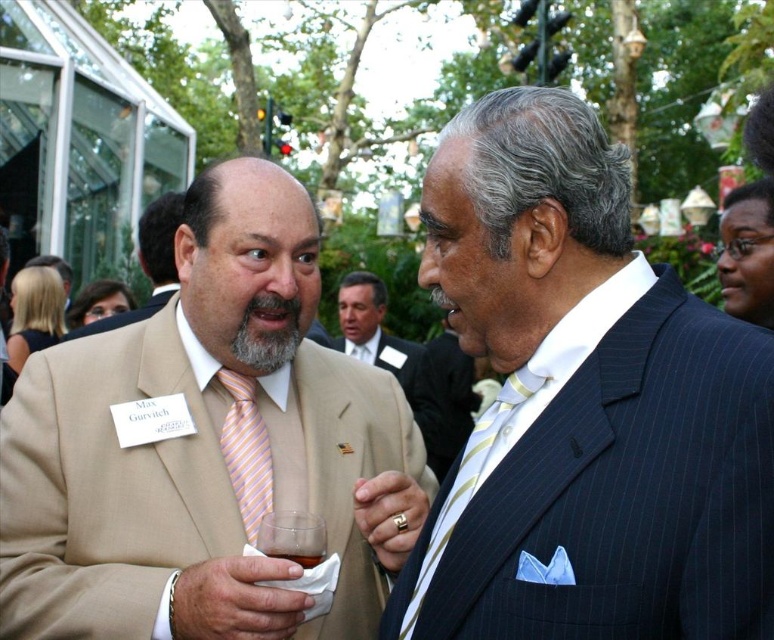
Between gold striped tie at center and light brown suit at center, which one appears on the left side from the viewer's perspective?

Positioned to the left is light brown suit at center.

Is the position of gold striped tie at center less distant than that of light brown suit at center?

Yes, gold striped tie at center is in front of light brown suit at center.

I want to click on gold striped tie at center, so click(471, 477).

Does dark blue pinstripe suit at center have a lesser height compared to beige fabric suit at left?

No.

Between point (451, 202) and point (98, 324), which one is positioned in front?

Point (451, 202)

Find the location of a particular element. The height and width of the screenshot is (640, 774). dark blue pinstripe suit at center is located at coordinates (584, 406).

Can you confirm if light brown suit at center is positioned below translucent plastic cup at lower center?

No.

Can you confirm if light brown suit at center is smaller than translucent plastic cup at lower center?

Incorrect, light brown suit at center is not smaller in size than translucent plastic cup at lower center.

Is point (362, 298) positioned in front of point (307, 552)?

No.

Where is `light brown suit at center`? light brown suit at center is located at coordinates (374, 330).